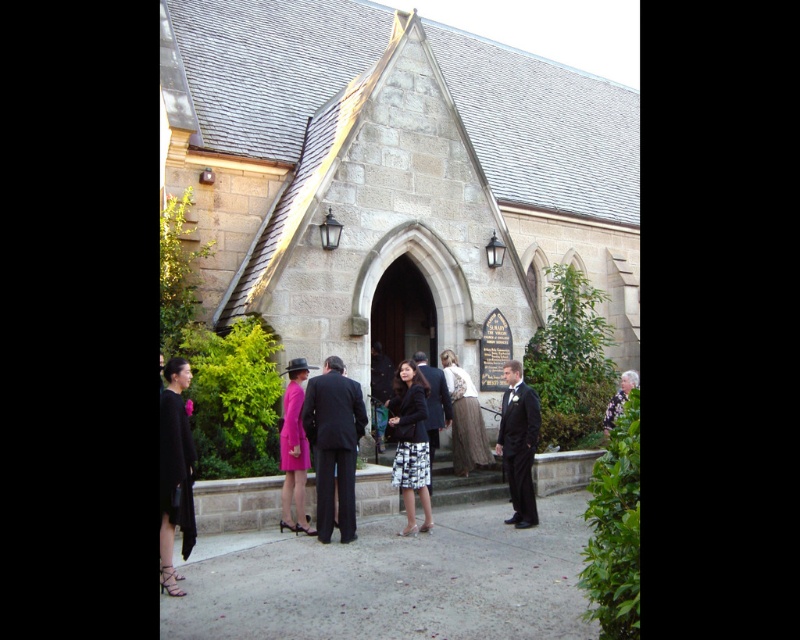
You are a photographer at the event and want to capture both the black and white printed skirt at center and the pink satin dress at center in the same frame. Which clothing item should you adjust your camera angle to focus on first to ensure both are in the frame?

The black and white printed skirt at center is shorter than the pink satin dress at center. To ensure both are in the frame, focus on the pink satin dress at center first as it is taller, then adjust the angle to include the shorter skirt.

You are a photographer standing at the front of the church, and you want to capture both the black satin dress at lower left and the pink satin dress at center in a single photo. Which dress should you focus on first to ensure both are in sharp focus?

You should focus on the black satin dress at lower left first because it is closer to the viewer than the pink satin dress at center. By focusing on the closer object, the depth of field may still keep the farther object in acceptable focus.